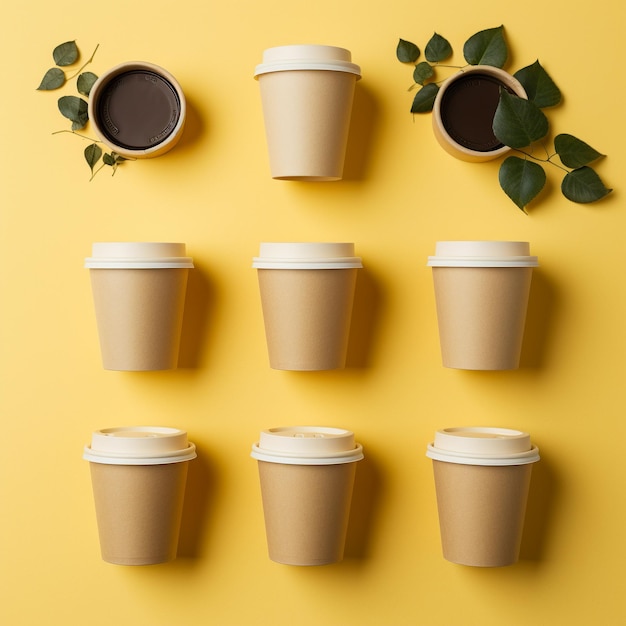
Where is `shadow of cup`? This screenshot has height=626, width=626. shadow of cup is located at coordinates (195, 491), (365, 483), (546, 493), (536, 327), (360, 326), (193, 309), (193, 126), (362, 135), (503, 158).